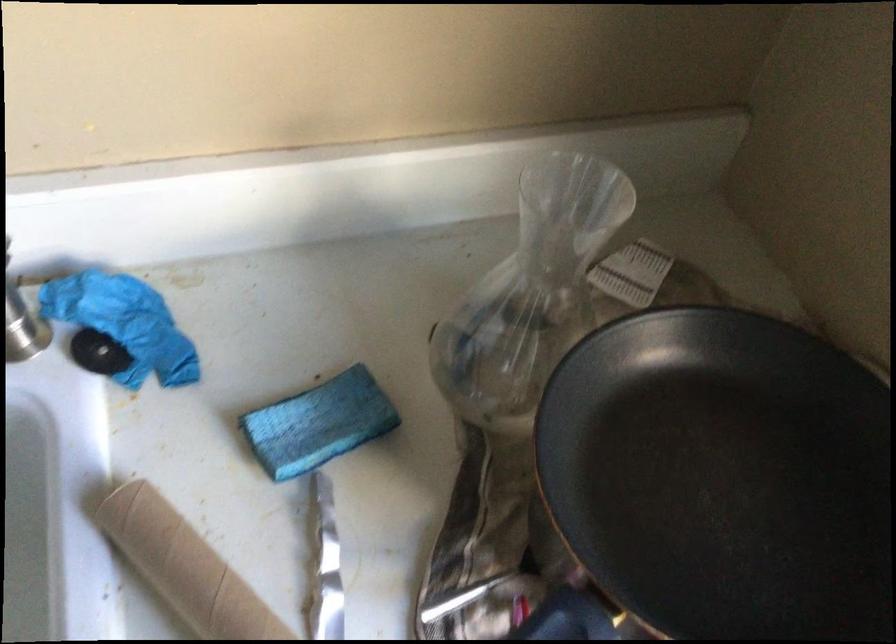
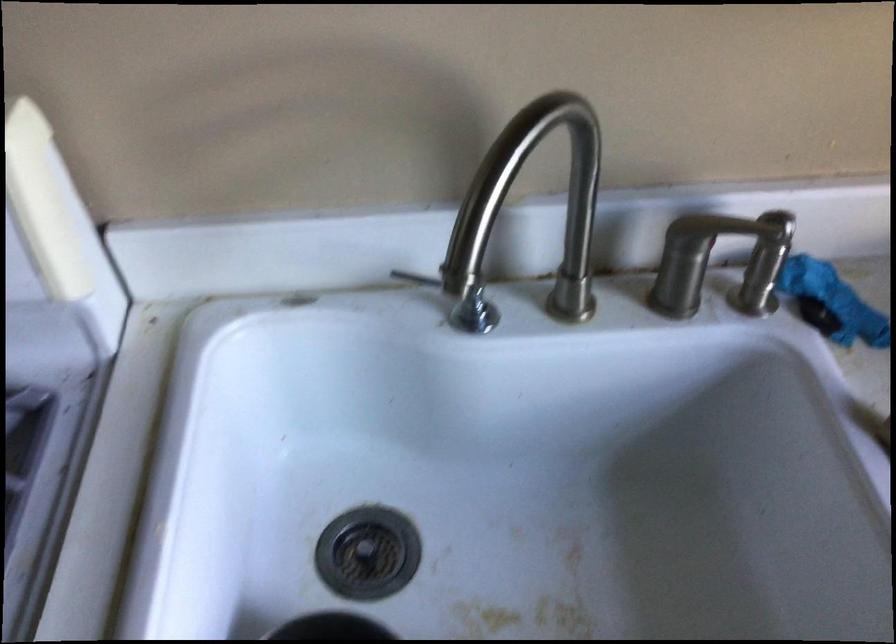
Question: The camera is either moving clockwise (left) or counter-clockwise (right) around the object. The first image is from the beginning of the video and the second image is from the end. Is the camera moving left or right when shooting the video?

Choices:
 (A) Left
 (B) Right

Answer: (B)